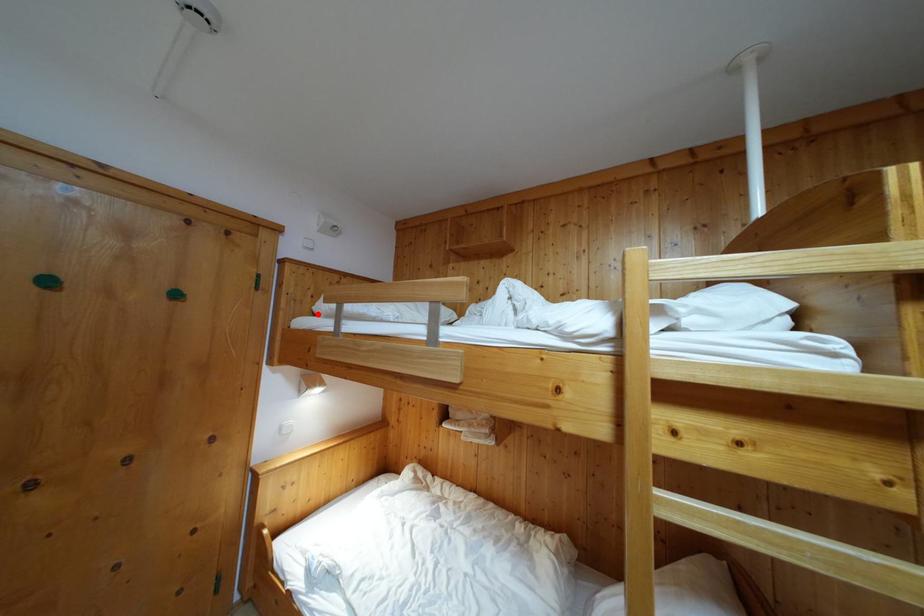
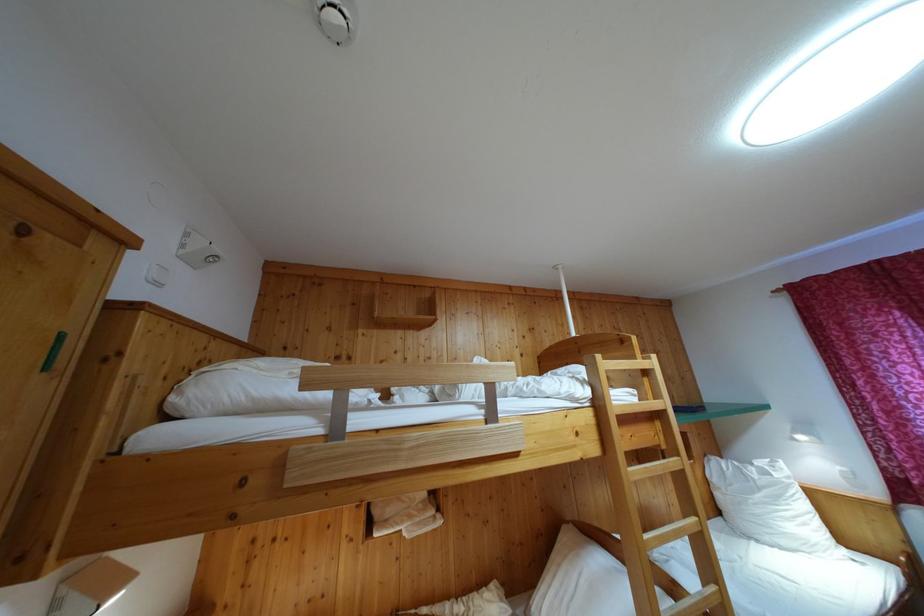
The point at the highlighted location is marked in the first image. Where is the corresponding point in the second image?

(176, 406)